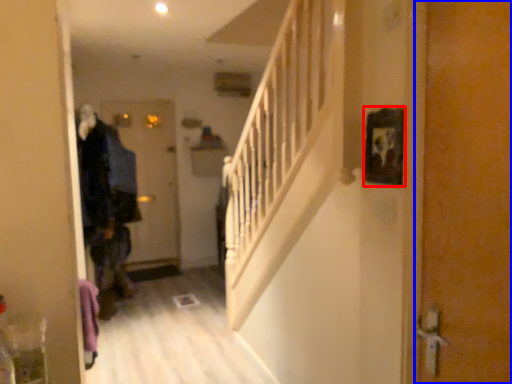
Question: Which object appears farthest to the camera in this image, picture frame (highlighted by a red box) or door (highlighted by a blue box)?

Choices:
 (A) picture frame
 (B) door

Answer: (A)